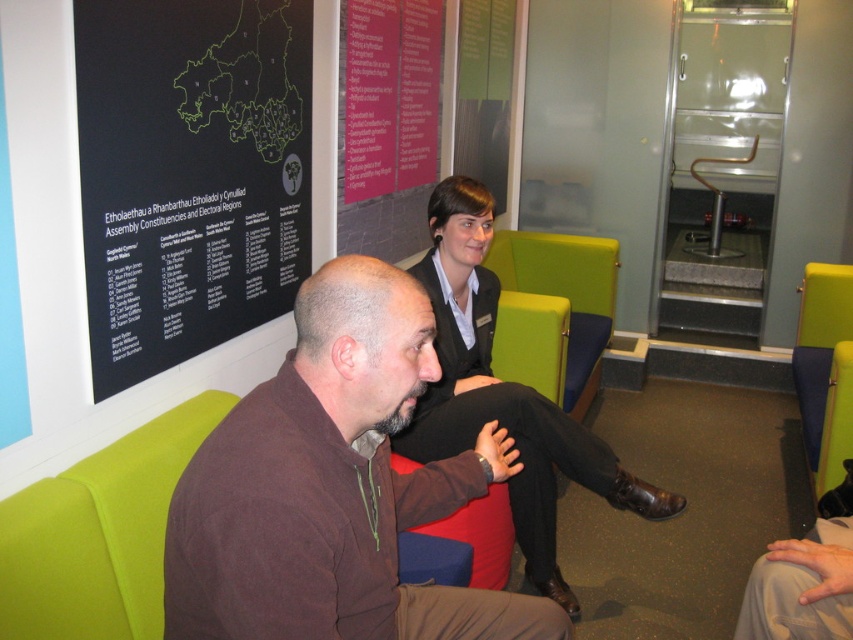
Is point (462, 408) positioned in front of point (815, 422)?

That is True.

Who is lower down, matte black blazer at center or green fabric armchair at lower right?

matte black blazer at center

Is point (473, 440) positioned after point (834, 449)?

No, it is not.

The height and width of the screenshot is (640, 853). Identify the location of matte black blazer at center. (503, 394).

The image size is (853, 640). What are the coordinates of `black matte/blackboard at upper left` in the screenshot? It's located at (189, 173).

Is black matte/blackboard at upper left taller than matte black blazer at center?

Incorrect, black matte/blackboard at upper left's height is not larger of matte black blazer at center's.

The width and height of the screenshot is (853, 640). Find the location of `black matte/blackboard at upper left`. black matte/blackboard at upper left is located at coordinates (189, 173).

At what (x,y) coordinates should I click in order to perform the action: click on black matte/blackboard at upper left. Please return your answer as a coordinate pair (x, y). This screenshot has width=853, height=640. Looking at the image, I should click on point(189,173).

Is green fabric armchair at lower right bigger than red fabric armchair at center?

Yes.

Who is lower down, green fabric armchair at lower right or red fabric armchair at center?

red fabric armchair at center is lower down.

Image resolution: width=853 pixels, height=640 pixels. I want to click on green fabric armchair at lower right, so click(x=824, y=365).